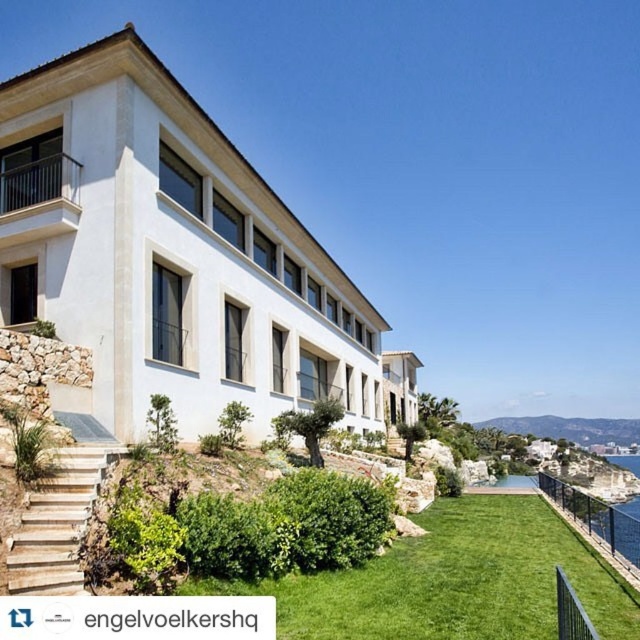
In the scene shown: You are standing on the green grass at lower center and want to reach the white smooth villa at center. Based on the scene, which direction should you move to ascend towards the villa?

Since the white smooth villa at center is located above the green grass at lower center, you should move upward towards the villa from the green grass at lower center.

You are a landscape architect planning to install a new garden feature between the white smooth villa at center and the natural stone stairs at lower left. Considering their sizes, which object should the garden feature be placed closer to for better visual balance?

The white smooth villa at center is bigger than natural stone stairs at lower left, so the garden feature should be placed closer to the natural stone stairs at lower left to balance the visual weight.